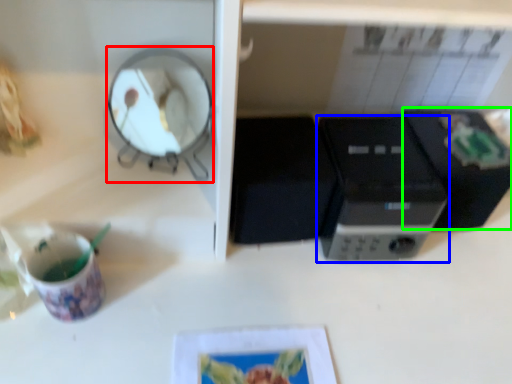
Question: Considering the real-world distances, which object is closest to mirror (highlighted by a red box)? home appliance (highlighted by a blue box) or appliance (highlighted by a green box).

Choices:
 (A) home appliance
 (B) appliance

Answer: (A)